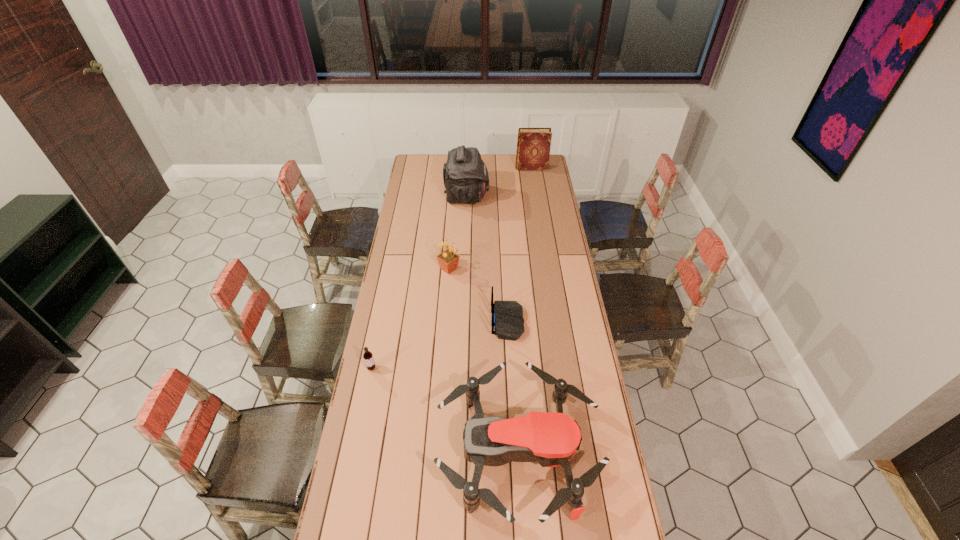
At what (x,y) coordinates should I click in order to perform the action: click on the fifth nearest object. Please return your answer as a coordinate pair (x, y). The width and height of the screenshot is (960, 540). Looking at the image, I should click on (465, 175).

This screenshot has height=540, width=960. Identify the location of shoulder bag. (465, 175).

Image resolution: width=960 pixels, height=540 pixels. Identify the location of the fifth shortest object. click(533, 147).

Where is `the farthest object`? The width and height of the screenshot is (960, 540). the farthest object is located at coordinates (533, 147).

Where is `sunflower`? sunflower is located at coordinates (448, 261).

This screenshot has width=960, height=540. I want to click on the fourth shortest object, so click(448, 261).

The height and width of the screenshot is (540, 960). Identify the location of drone. point(552,439).

The width and height of the screenshot is (960, 540). What are the coordinates of `router` in the screenshot? It's located at (507, 322).

Identify the location of the second nearest object. The height and width of the screenshot is (540, 960). coord(368,356).

Locate an element on the screen. The height and width of the screenshot is (540, 960). the leftmost object is located at coordinates (368, 356).